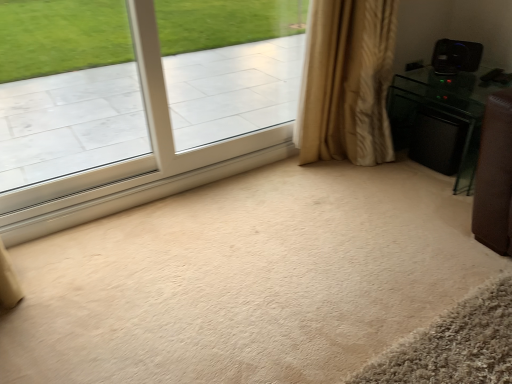
Question: Relative to black glossy speaker at right, is clear glass window at upper left in front or behind?

Choices:
 (A) behind
 (B) front

Answer: (B)

Question: Is clear glass window at upper left situated inside black glossy speaker at right or outside?

Choices:
 (A) inside
 (B) outside

Answer: (B)

Question: Considering the real-world distances, which object is closest to the beige textured curtain at right?

Choices:
 (A) clear glass window at upper left
 (B) black plastic speaker at upper right
 (C) black glossy speaker at right

Answer: (C)

Question: Which object is positioned farthest from the clear glass window at upper left?

Choices:
 (A) black plastic speaker at upper right
 (B) black glossy speaker at right
 (C) beige textured curtain at right

Answer: (A)